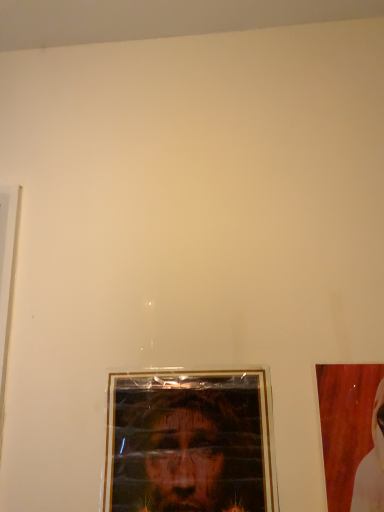
Question: Should I look upward or downward to see matte plastic portrait at center?

Choices:
 (A) down
 (B) up

Answer: (A)

Question: From the image's perspective, is wooden picture frame at right on matte plastic portrait at center?

Choices:
 (A) yes
 (B) no

Answer: (A)

Question: Is wooden picture frame at right facing towards matte plastic portrait at center?

Choices:
 (A) no
 (B) yes

Answer: (A)

Question: Can you confirm if wooden picture frame at right is thinner than matte plastic portrait at center?

Choices:
 (A) yes
 (B) no

Answer: (A)

Question: Is wooden picture frame at right behind matte plastic portrait at center?

Choices:
 (A) yes
 (B) no

Answer: (B)

Question: Is wooden picture frame at right placed right next to matte plastic portrait at center?

Choices:
 (A) no
 (B) yes

Answer: (A)

Question: Considering the relative positions of wooden picture frame at right and matte plastic portrait at center in the image provided, is wooden picture frame at right in front of matte plastic portrait at center?

Choices:
 (A) yes
 (B) no

Answer: (A)

Question: From a real-world perspective, is matte plastic portrait at center under wooden picture frame at right?

Choices:
 (A) no
 (B) yes

Answer: (B)

Question: Does matte plastic portrait at center have a greater width compared to wooden picture frame at right?

Choices:
 (A) yes
 (B) no

Answer: (A)

Question: Would you say matte plastic portrait at center is outside wooden picture frame at right?

Choices:
 (A) yes
 (B) no

Answer: (A)

Question: From the image's perspective, is matte plastic portrait at center under wooden picture frame at right?

Choices:
 (A) yes
 (B) no

Answer: (A)

Question: From the image's perspective, does matte plastic portrait at center appear higher than wooden picture frame at right?

Choices:
 (A) no
 (B) yes

Answer: (A)

Question: Considering the relative sizes of matte plastic portrait at center and wooden picture frame at right in the image provided, is matte plastic portrait at center taller than wooden picture frame at right?

Choices:
 (A) no
 (B) yes

Answer: (B)

Question: Considering the positions of point (349, 479) and point (167, 490), is point (349, 479) closer or farther from the camera than point (167, 490)?

Choices:
 (A) closer
 (B) farther

Answer: (A)